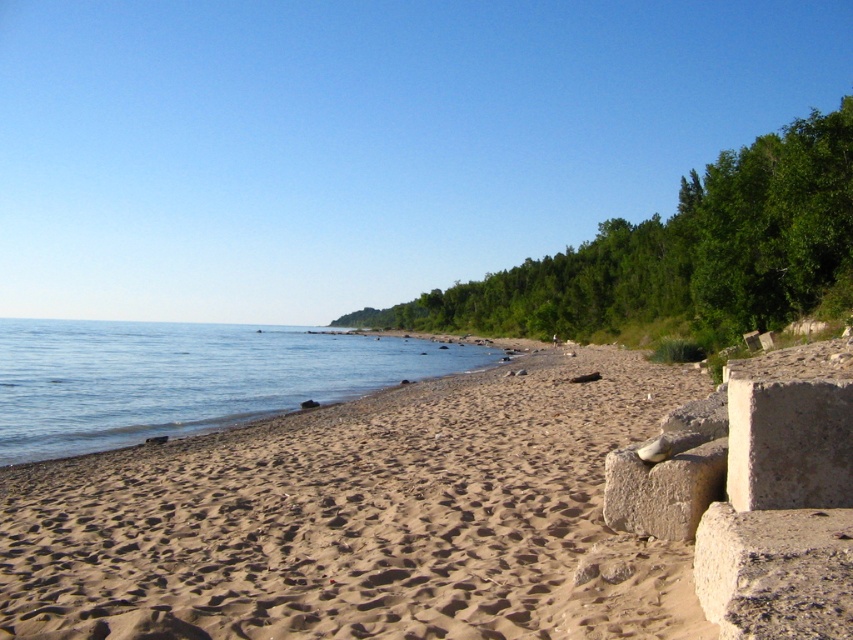
You are standing on the beach and want to walk to both the point at coordinates point (x=434, y=515) and point (x=74, y=378). Which point should you reach first if you want to minimize your walking distance?

You should reach point (x=434, y=515) first because it is closer to you than point (x=74, y=378).